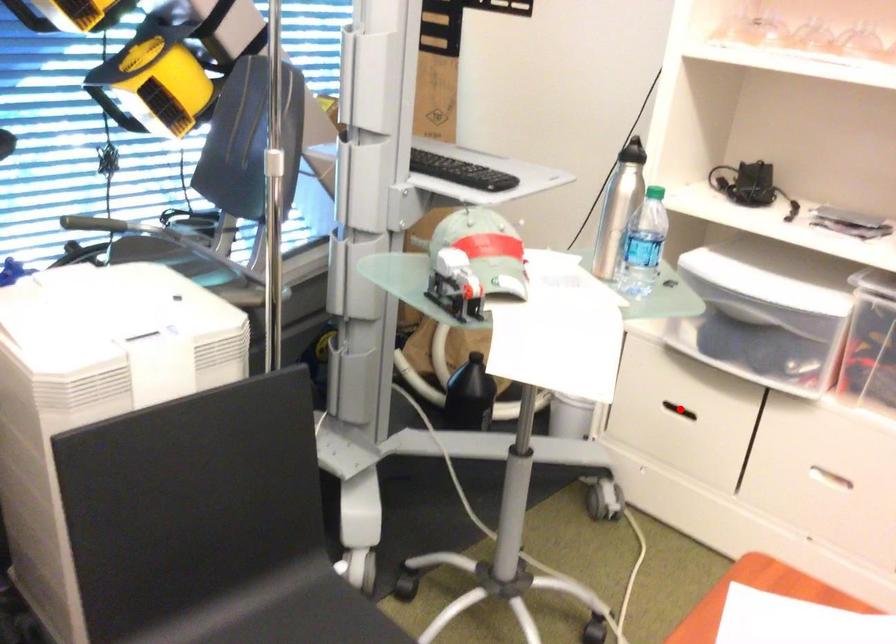
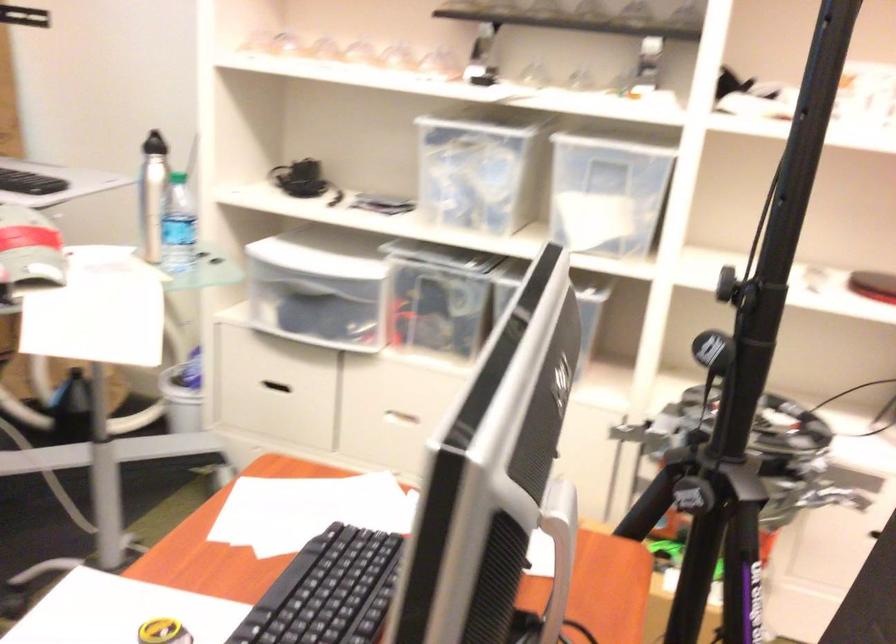
Question: I am providing you with two images of the same scene from different viewpoints. A red point is shown in image1. For the corresponding object point in image2, is it positioned nearer or farther from the camera?

Choices:
 (A) Nearer
 (B) Farther

Answer: (B)